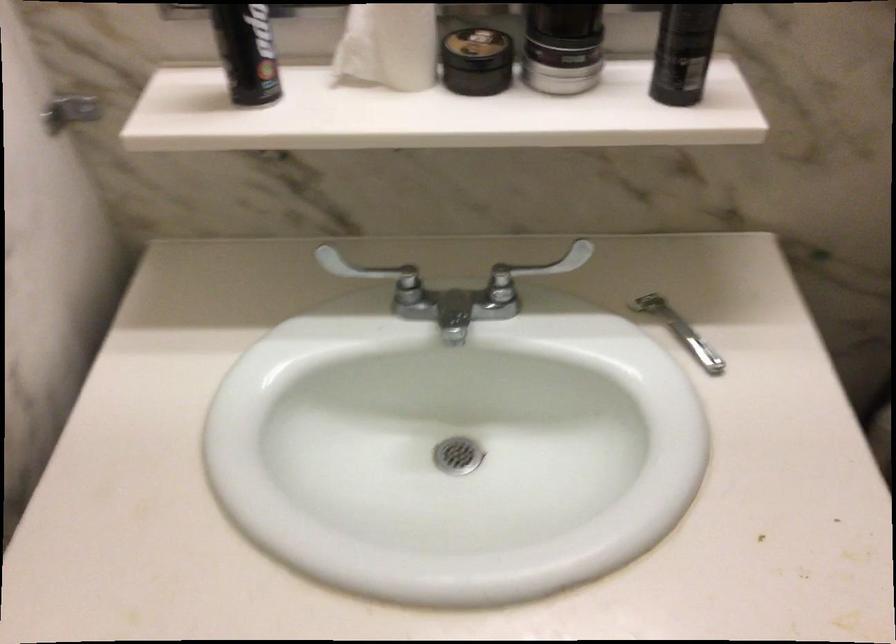
This screenshot has height=644, width=896. Find the location of `silver razor`. silver razor is located at coordinates (679, 330).